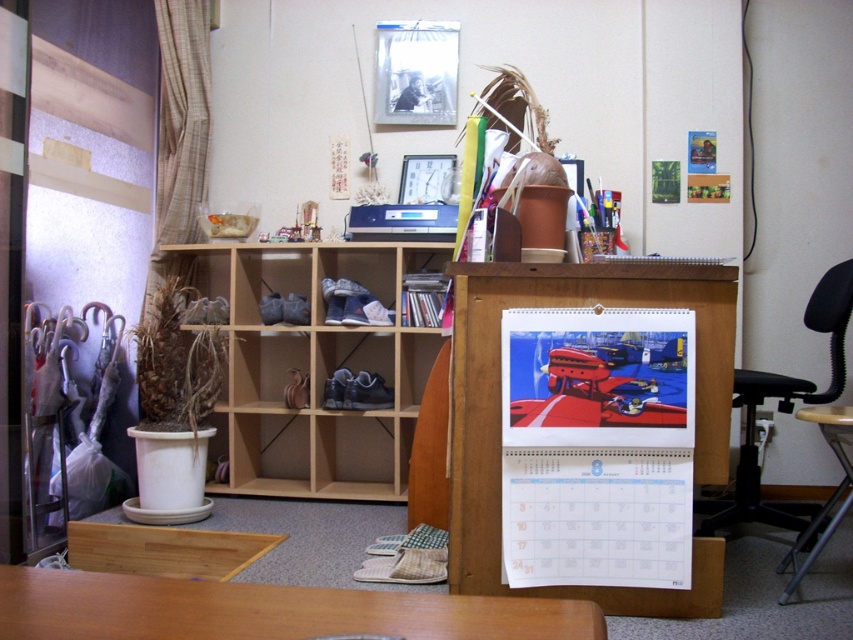
Question: Based on their relative distances, which object is nearer to the wooden table at lower center?

Choices:
 (A) black plastic swivel chair at lower right
 (B) black plastic chair at right

Answer: (A)

Question: Which point appears closest to the camera in this image?

Choices:
 (A) (843, 298)
 (B) (808, 525)
 (C) (691, 266)

Answer: (C)

Question: Is wooden table at lower center smaller than black plastic swivel chair at lower right?

Choices:
 (A) yes
 (B) no

Answer: (A)

Question: Is wooden at center above black plastic chair at right?

Choices:
 (A) yes
 (B) no

Answer: (A)

Question: Is wooden at left behind wooden table at lower center?

Choices:
 (A) no
 (B) yes

Answer: (B)

Question: Which is nearer to the wooden table at lower center?

Choices:
 (A) black plastic swivel chair at lower right
 (B) wooden at left
 (C) wooden at center

Answer: (C)